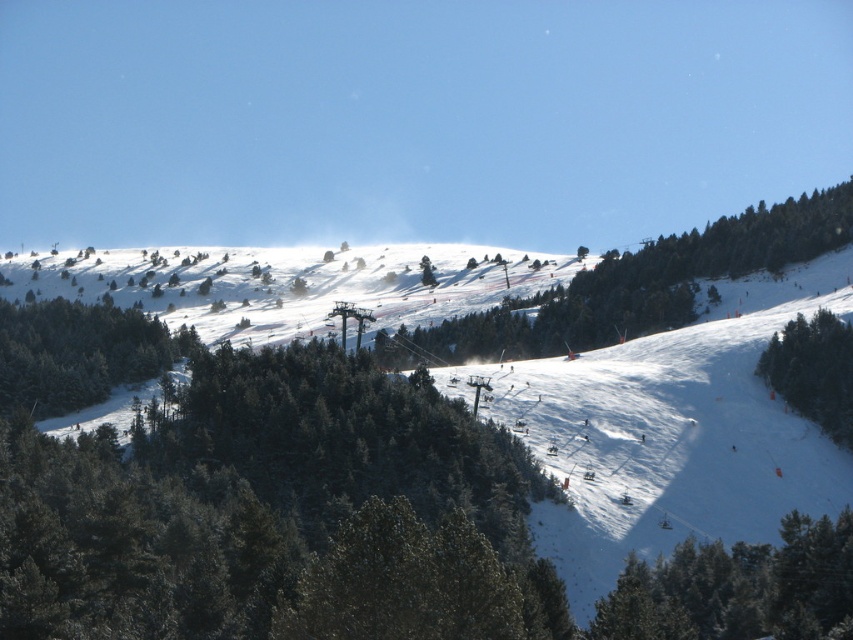
Question: Does white powdery snow at upper center appear over green matte tree at left?

Choices:
 (A) yes
 (B) no

Answer: (A)

Question: In this image, where is green matte tree at left located relative to green matte tree at right?

Choices:
 (A) above
 (B) below

Answer: (A)

Question: Which point appears farthest from the camera in this image?

Choices:
 (A) (683, 260)
 (B) (793, 340)
 (C) (474, 275)

Answer: (C)

Question: Which object is farther from the camera taking this photo?

Choices:
 (A) green matte tree at left
 (B) green matte tree at lower right

Answer: (A)

Question: Which point is closer to the camera taking this photo?

Choices:
 (A) (518, 326)
 (B) (845, 396)
 (C) (38, 410)
 (D) (631, 557)

Answer: (D)

Question: Can you confirm if green matte tree at lower right is smaller than green matte tree at left?

Choices:
 (A) no
 (B) yes

Answer: (B)